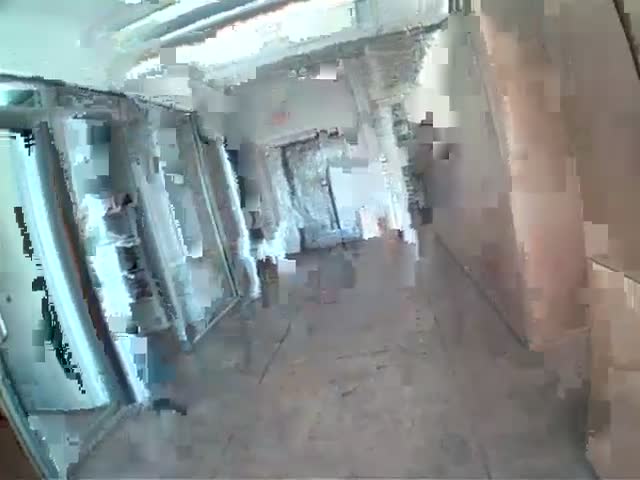
Image resolution: width=640 pixels, height=480 pixels. Identify the location of door. (300, 169).